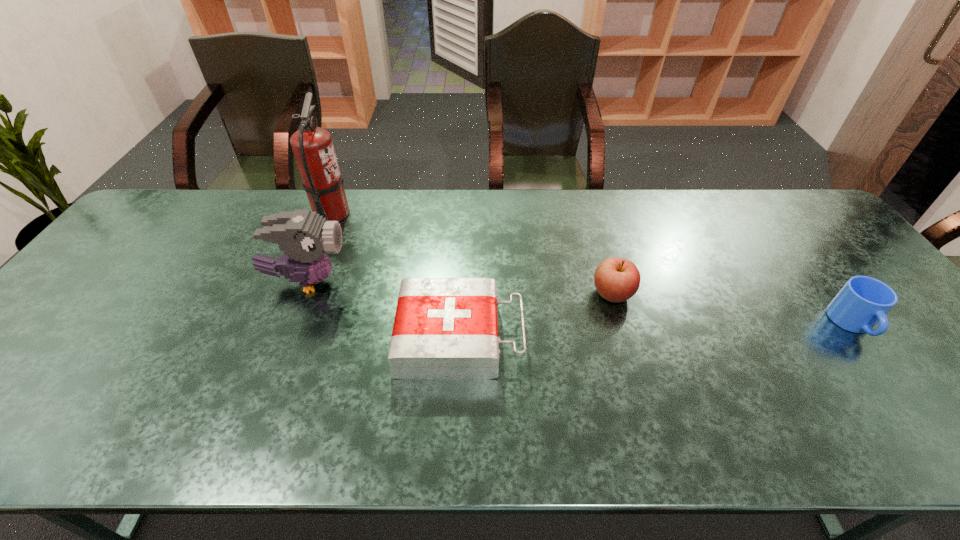
Identify the location of fire extinguisher. (312, 146).

Locate an element on the screen. This screenshot has height=540, width=960. the tallest object is located at coordinates (312, 146).

The width and height of the screenshot is (960, 540). Identify the location of the fourth shortest object. (303, 236).

Locate an element on the screen. the fourth object from left to right is located at coordinates (616, 279).

Locate an element on the screen. The height and width of the screenshot is (540, 960). the rightmost object is located at coordinates (863, 301).

You are a GUI agent. You are given a task and a screenshot of the screen. Output one action in this format:
    pyautogui.click(x=<x>, y=<y>)
    Task: Click on the shortest object
    
    Given the screenshot: What is the action you would take?
    pyautogui.click(x=445, y=328)

This screenshot has width=960, height=540. I want to click on the first-aid kit, so click(445, 328).

Find the location of a particular element. blank space located 0.330m toward the nozzle of the farthest object is located at coordinates (452, 214).

This screenshot has width=960, height=540. Identify the location of free point located 0.350m at the beak of the bird. (478, 282).

At what (x,y) coordinates should I click in order to perform the action: click on vacant position located on the front of the second object from right to left. Please return your answer as a coordinate pair (x, y). The height and width of the screenshot is (540, 960). Looking at the image, I should click on (628, 345).